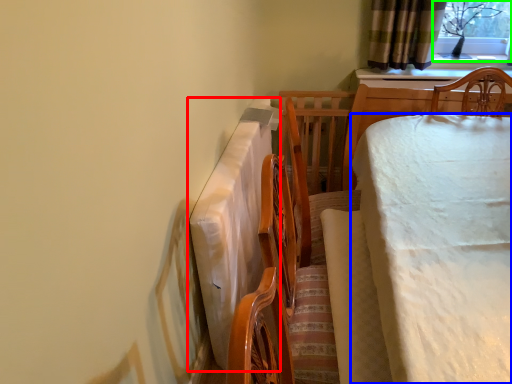
Question: Considering the real-world distances, which object is closest to tablecloth (highlighted by a red box)? table (highlighted by a blue box) or window screen (highlighted by a green box).

Choices:
 (A) table
 (B) window screen

Answer: (A)